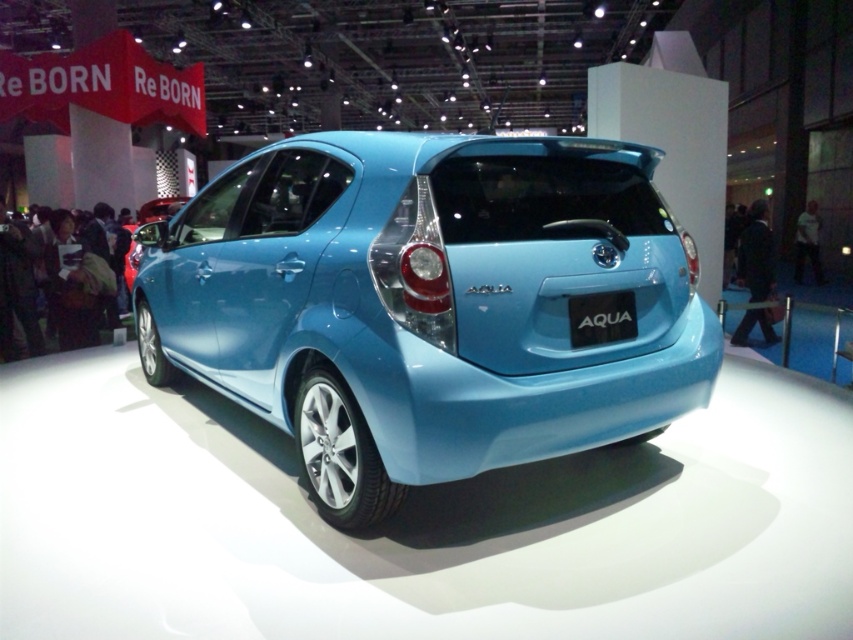
Does point (274, 209) lie in front of point (624, 310)?

No, it is behind (624, 310).

Between light blue metallic hatchback at center and blue glossy license plate at rear, which one has more height?

With more height is light blue metallic hatchback at center.

Is point (397, 147) in front of point (582, 328)?

Yes, it is in front of point (582, 328).

What are the coordinates of `light blue metallic hatchback at center` in the screenshot? It's located at point(426,305).